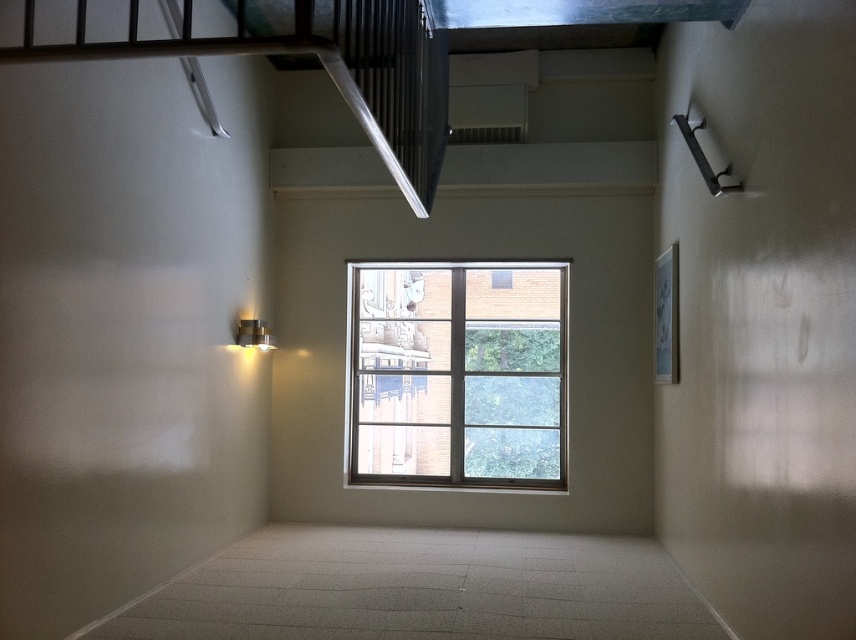
From the picture: Can you confirm if clear glass window at center is positioned to the right of metallic silver stairwell at upper left?

Indeed, clear glass window at center is positioned on the right side of metallic silver stairwell at upper left.

Is clear glass window at center closer to the viewer compared to metallic silver stairwell at upper left?

No, clear glass window at center is further to the viewer.

Locate an element on the screen. The width and height of the screenshot is (856, 640). clear glass window at center is located at coordinates (458, 374).